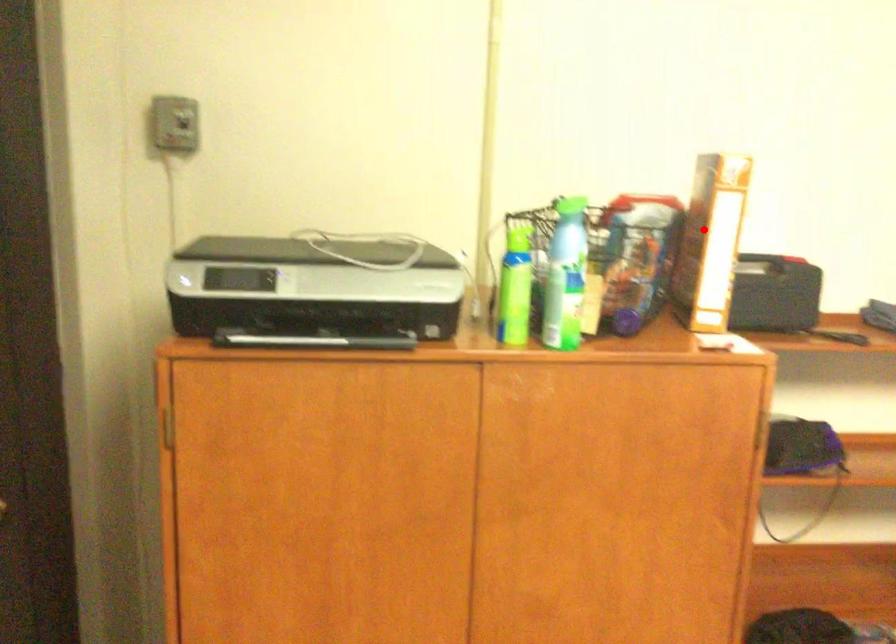
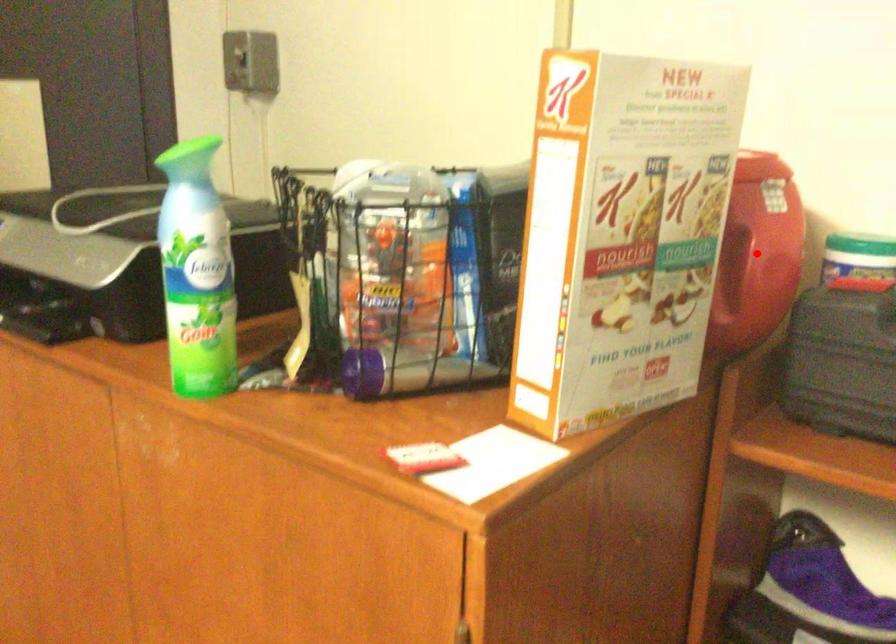
I am providing you with two images of the same scene from different viewpoints. A red point is marked on the first image and another point is marked on the second image. Does the point marked in image1 correspond to the same location as the one in image2?

Yes